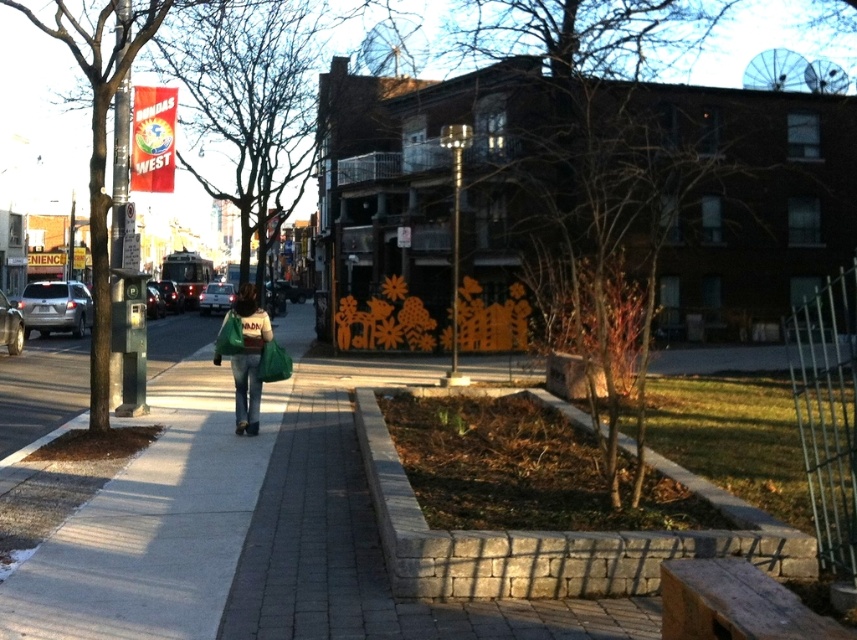
Does gray concrete sidewalk at center lie in front of green fabric bag at center?

Yes, it is.

Does gray concrete sidewalk at center appear under green fabric bag at center?

Indeed, gray concrete sidewalk at center is positioned under green fabric bag at center.

This screenshot has width=857, height=640. What do you see at coordinates (154, 524) in the screenshot?
I see `gray concrete sidewalk at center` at bounding box center [154, 524].

The image size is (857, 640). Find the location of `gray concrete sidewalk at center`. gray concrete sidewalk at center is located at coordinates (154, 524).

Can you confirm if stone curb at lower center is positioned below green fabric jacket at center?

Yes, stone curb at lower center is below green fabric jacket at center.

Does stone curb at lower center appear on the left side of green fabric jacket at center?

Incorrect, stone curb at lower center is not on the left side of green fabric jacket at center.

The height and width of the screenshot is (640, 857). Describe the element at coordinates (550, 531) in the screenshot. I see `stone curb at lower center` at that location.

Find the location of `stone curb at lower center`. stone curb at lower center is located at coordinates coord(550,531).

Based on the photo, is the position of green fabric bag at center more distant than that of green fabric jacket at center?

That is True.

From the picture: Can you confirm if green fabric bag at center is positioned to the right of green fabric jacket at center?

Incorrect, green fabric bag at center is not on the right side of green fabric jacket at center.

Does point (256, 346) come closer to viewer compared to point (220, 330)?

That is True.

Locate an element on the screen. Image resolution: width=857 pixels, height=640 pixels. green fabric bag at center is located at coordinates (249, 358).